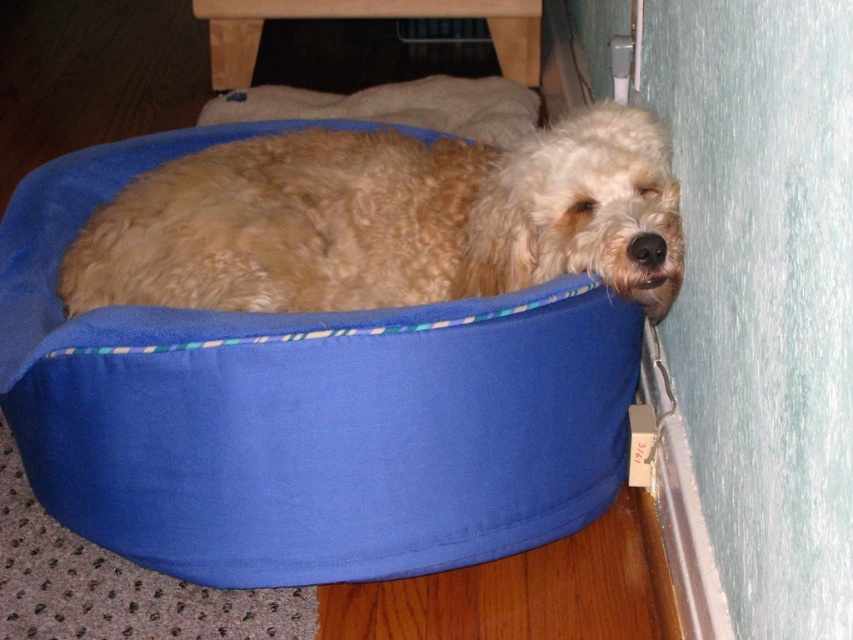
Question: Which object is closer to the camera taking this photo?

Choices:
 (A) fluffy golden dog at lower right
 (B) blue fabric dog bed at lower left

Answer: (B)

Question: Does blue fabric dog bed at lower left have a greater width compared to fluffy golden dog at lower right?

Choices:
 (A) no
 (B) yes

Answer: (B)

Question: Can you confirm if blue fabric dog bed at lower left is thinner than fluffy golden dog at lower right?

Choices:
 (A) no
 (B) yes

Answer: (A)

Question: Is blue fabric dog bed at lower left above fluffy golden dog at lower right?

Choices:
 (A) no
 (B) yes

Answer: (A)

Question: Which point appears farthest from the camera in this image?

Choices:
 (A) (341, 493)
 (B) (138, 221)

Answer: (B)